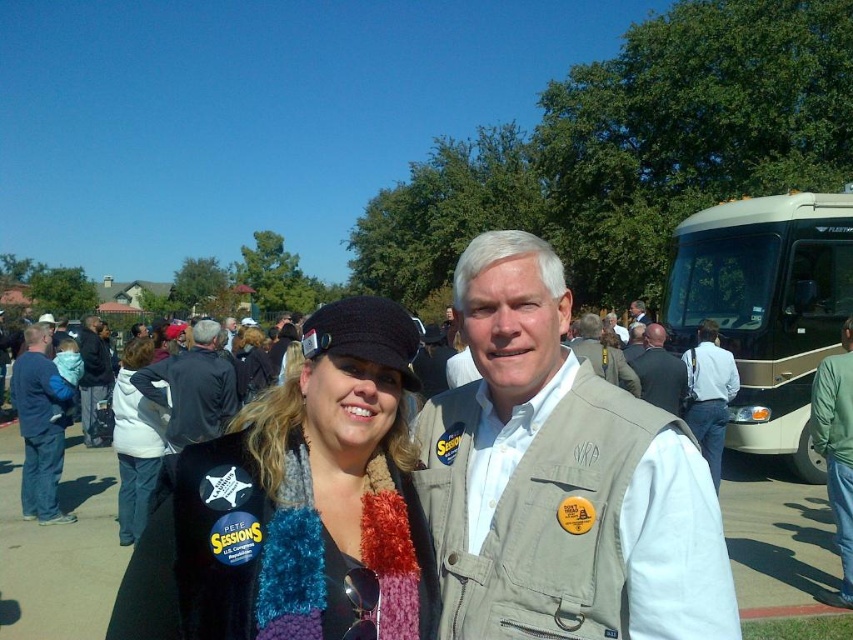
Is tan fabric vest at center smaller than blue denim jeans at left?

Yes, tan fabric vest at center is smaller than blue denim jeans at left.

Does tan fabric vest at center appear on the left side of blue denim jeans at left?

Incorrect, tan fabric vest at center is not on the left side of blue denim jeans at left.

Find the location of a particular element. The height and width of the screenshot is (640, 853). tan fabric vest at center is located at coordinates (560, 480).

Locate an element on the screen. The image size is (853, 640). tan fabric vest at center is located at coordinates (560, 480).

The width and height of the screenshot is (853, 640). What are the coordinates of `gold metallic bus at right` in the screenshot? It's located at click(x=766, y=307).

Is blue denim jeans at left wider than white fleece jacket at lower left?

Yes, blue denim jeans at left is wider than white fleece jacket at lower left.

Which is in front, point (51, 474) or point (123, 525)?

Point (123, 525) is more forward.

Describe the element at coordinates (39, 424) in the screenshot. The height and width of the screenshot is (640, 853). I see `blue denim jeans at left` at that location.

The width and height of the screenshot is (853, 640). What are the coordinates of `blue denim jeans at left` in the screenshot? It's located at (39, 424).